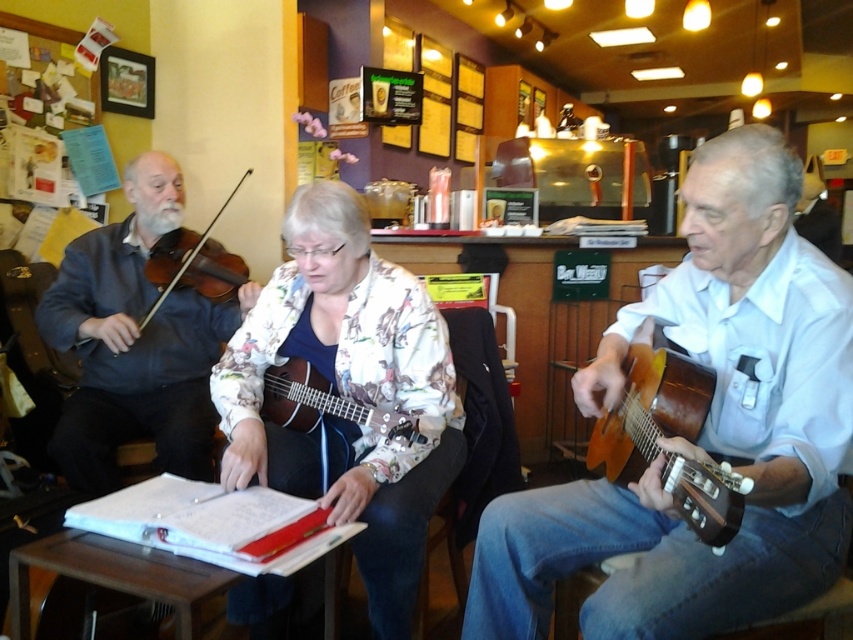
Question: Is wooden acoustic guitar at center right bigger than matte brown violin at left?

Choices:
 (A) no
 (B) yes

Answer: (B)

Question: Estimate the real-world distances between objects in this image. Which object is farther from the matte brown violin at left?

Choices:
 (A) printed fabric ukulele at center
 (B) matte black violin at left
 (C) matte brown ukulele at center
 (D) wooden acoustic guitar at center right

Answer: (D)

Question: Which is nearer to the printed fabric ukulele at center?

Choices:
 (A) matte black violin at left
 (B) shiny brown acoustic guitar at right

Answer: (B)

Question: Can you confirm if wooden acoustic guitar at center right is wider than matte brown ukulele at center?

Choices:
 (A) yes
 (B) no

Answer: (A)

Question: Which point is closer to the camera?

Choices:
 (A) (305, 456)
 (B) (618, 481)

Answer: (B)

Question: Does shiny brown acoustic guitar at right have a smaller size compared to matte brown violin at left?

Choices:
 (A) yes
 (B) no

Answer: (A)